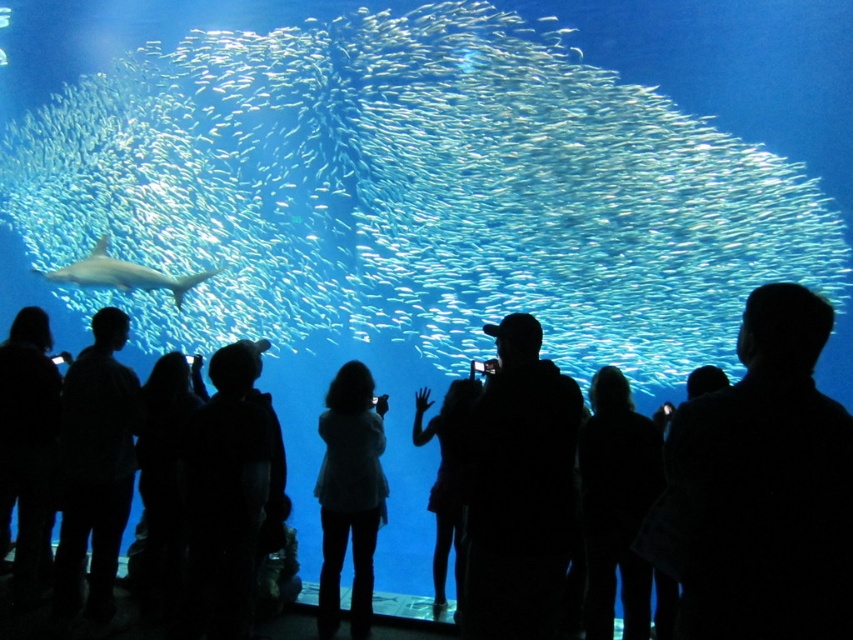
Question: Does black matte person at upper right appear over black matte person at left?

Choices:
 (A) yes
 (B) no

Answer: (A)

Question: Which point appears closest to the camera in this image?

Choices:
 (A) click(x=817, y=468)
 (B) click(x=582, y=452)

Answer: (A)

Question: Is black matte person at left in front of smooth gray shark at center?

Choices:
 (A) yes
 (B) no

Answer: (A)

Question: Which of the following is the farthest from the observer?

Choices:
 (A) black matte person at center
 (B) black matte cap at center
 (C) black matte person at left

Answer: (C)

Question: Does black matte cap at center have a greater width compared to silhouette dress at center?

Choices:
 (A) no
 (B) yes

Answer: (B)

Question: Among these points, which one is farthest from the camera?

Choices:
 (A) (785, 154)
 (B) (152, 288)

Answer: (A)